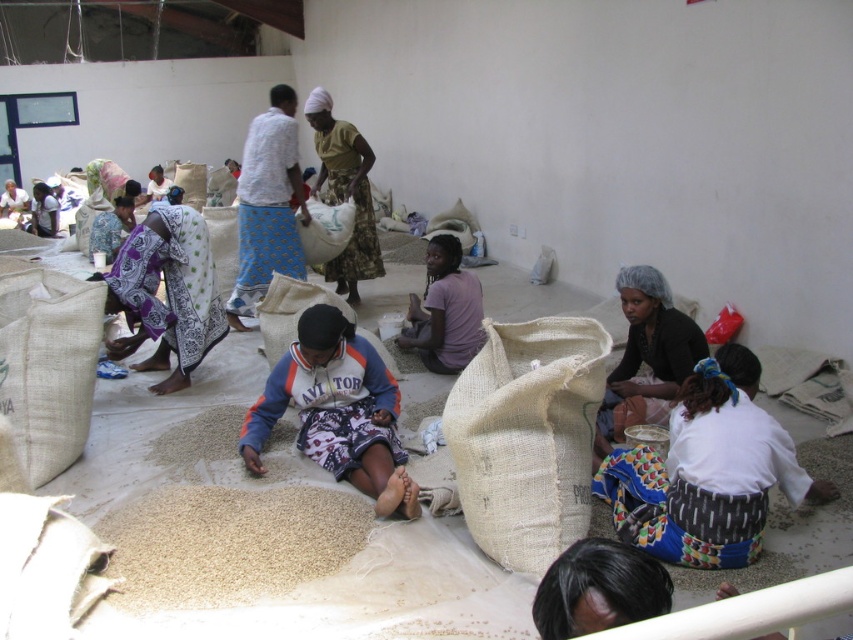
Based on the photo, you are a worker in the sorting area and need to place a new tool next to the brown grain at center. However, there is a purple matte shirt at center nearby. Which object should you avoid placing the tool near to ensure it doesn

You should avoid placing the tool near the purple matte shirt at center because the brown grain at center might be wider and could provide more space for the tool.